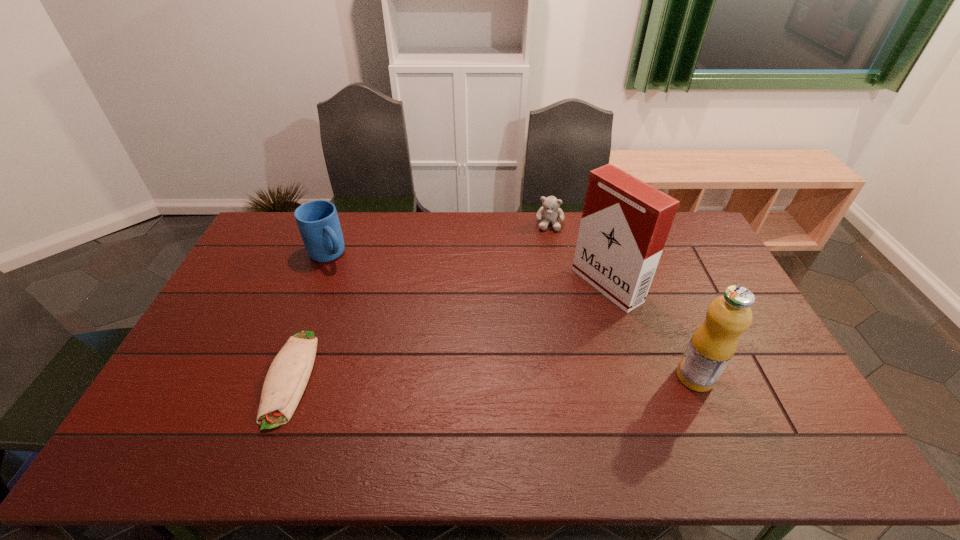
This screenshot has width=960, height=540. In order to click on free space that satisfies the following two spatial constraints: 1. on the front side of the teddy bear; 2. on the front label of the fruit juice in this screenshot , I will do `click(580, 377)`.

The image size is (960, 540). Identify the location of vacant space that satisfies the following two spatial constraints: 1. on the front side of the farthest object; 2. on the front label of the rightmost object. (580, 377).